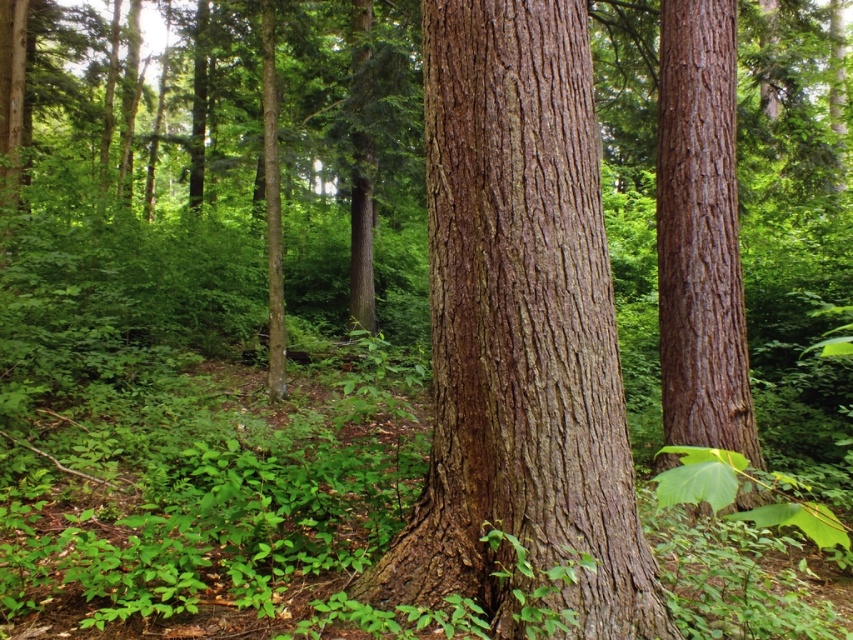
Question: Which point is closer to the camera taking this photo?

Choices:
 (A) (729, 72)
 (B) (447, 26)

Answer: (B)

Question: Among these objects, which one is nearest to the camera?

Choices:
 (A) brown rough bark tree trunk at center
 (B) smooth brown bark at center

Answer: (A)

Question: Can you confirm if brown rough bark tree trunk at center is positioned below smooth brown bark at center?

Choices:
 (A) yes
 (B) no

Answer: (A)

Question: Considering the relative positions of brown rough bark tree trunk at center and smooth brown bark at center in the image provided, where is brown rough bark tree trunk at center located with respect to smooth brown bark at center?

Choices:
 (A) left
 (B) right

Answer: (A)

Question: Is brown rough bark tree trunk at center smaller than smooth brown bark at center?

Choices:
 (A) no
 (B) yes

Answer: (A)